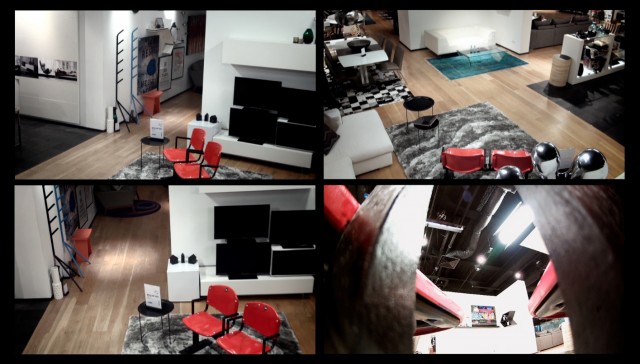
The image size is (640, 364). Identify the location of seat of red chair. pos(204,326).